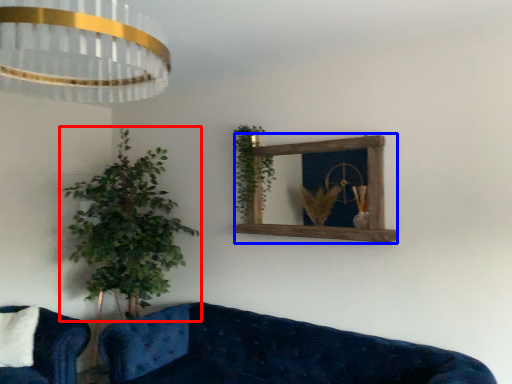
Question: Which object is further to the camera taking this photo, houseplant (highlighted by a red box) or window frame (highlighted by a blue box)?

Choices:
 (A) houseplant
 (B) window frame

Answer: (A)